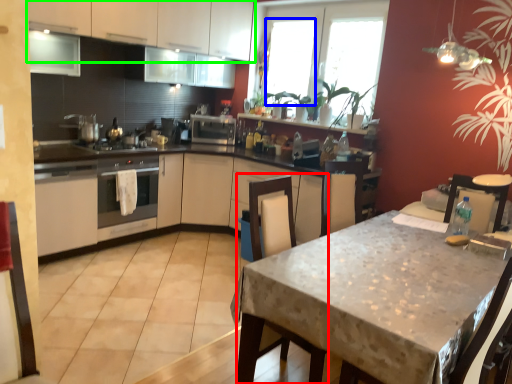
Question: Considering the real-world distances, which object is closest to swivel chair (highlighted by a red box)? window (highlighted by a blue box) or cabinetry (highlighted by a green box).

Choices:
 (A) window
 (B) cabinetry

Answer: (B)